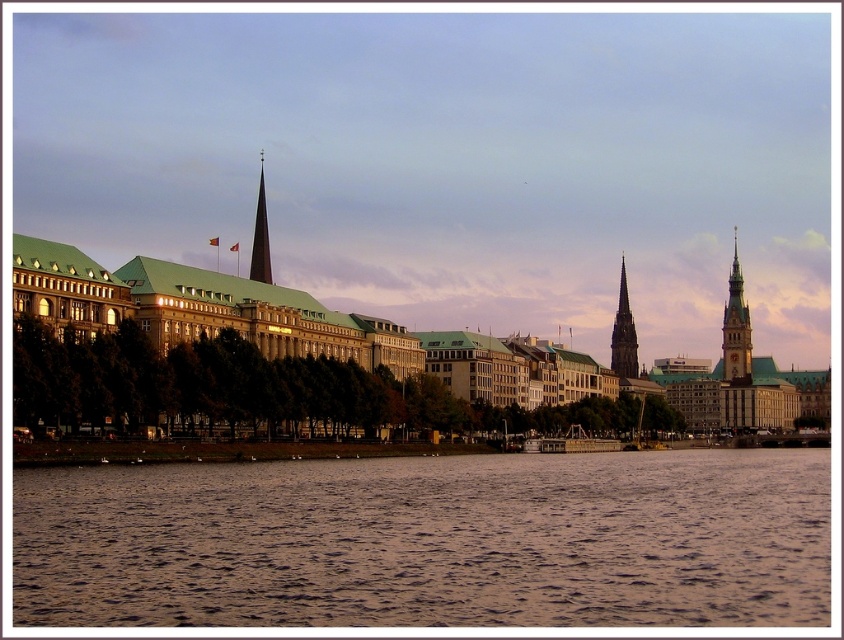
Is green matte building at center positioned before dark gray stone spire at center right?

Yes, it is in front of dark gray stone spire at center right.

Is green matte building at center above dark gray stone spire at center right?

Indeed, green matte building at center is positioned over dark gray stone spire at center right.

Is point (35, 291) positioned after point (620, 342)?

No, it is not.

Identify the location of green matte building at center. The height and width of the screenshot is (640, 844). point(376,339).

Is brown water at lower center bigger than shiny dark glass spire at center?

No.

At what (x,y) coordinates should I click in order to perform the action: click on brown water at lower center. Please return your answer as a coordinate pair (x, y). The image size is (844, 640). Looking at the image, I should click on (429, 541).

You are a GUI agent. You are given a task and a screenshot of the screen. Output one action in this format:
    pyautogui.click(x=<x>, y=<y>)
    Task: Click on the brown water at lower center
    The width and height of the screenshot is (844, 640).
    Given the screenshot: What is the action you would take?
    pyautogui.click(x=429, y=541)

Between point (723, 307) and point (630, 353), which one is positioned behind?

Positioned behind is point (723, 307).

Which is above, gold textured clock tower at right or dark gray stone spire at center right?

gold textured clock tower at right is higher up.

Is point (748, 333) closer to camera compared to point (621, 262)?

Yes, it is in front of point (621, 262).

Where is `gold textured clock tower at right`? This screenshot has width=844, height=640. gold textured clock tower at right is located at coordinates (736, 326).